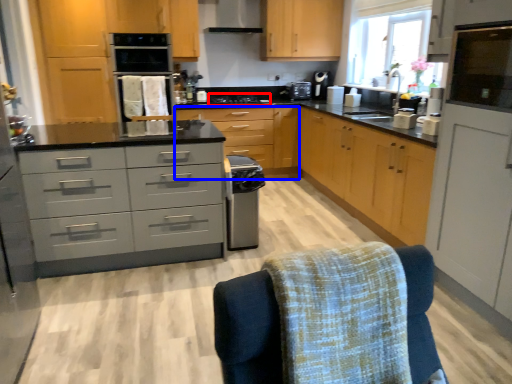
Question: Which point is further to the camera, stove (highlighted by a red box) or cabinetry (highlighted by a blue box)?

Choices:
 (A) stove
 (B) cabinetry

Answer: (A)